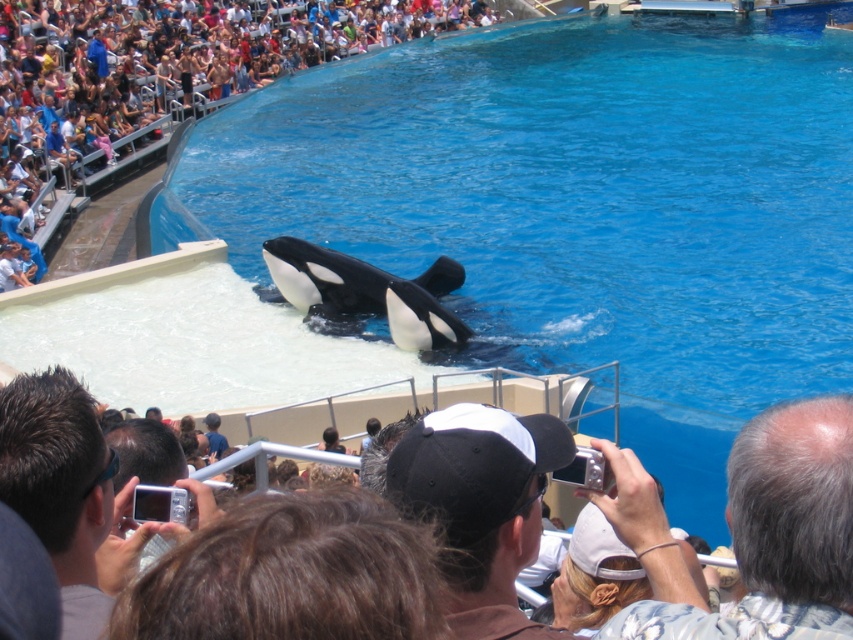
Question: Can you confirm if black smooth water at center is smaller than smooth skin crowd at upper left?

Choices:
 (A) no
 (B) yes

Answer: (A)

Question: Among these points, which one is farthest from the camera?

Choices:
 (A) (296, 285)
 (B) (502, 156)

Answer: (B)

Question: Can you confirm if black matte baseball cap at center is thinner than black smooth orca at center?

Choices:
 (A) no
 (B) yes

Answer: (B)

Question: Among these objects, which one is farthest from the camera?

Choices:
 (A) black matte baseball cap at center
 (B) smooth skin crowd at upper left

Answer: (B)

Question: Can you confirm if black smooth water at center is positioned below black matte baseball cap at center?

Choices:
 (A) yes
 (B) no

Answer: (B)

Question: Which object is the closest to the black matte baseball cap at center?

Choices:
 (A) black smooth water at center
 (B) smooth skin crowd at upper left
 (C) black smooth orca at center

Answer: (C)